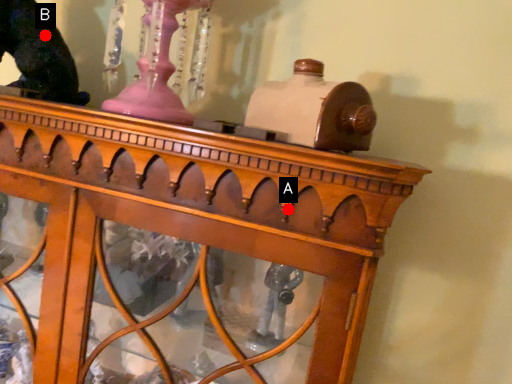
Question: Two points are circled on the image, labeled by A and B beside each circle. Which point is farther to the camera?

Choices:
 (A) A is further
 (B) B is further

Answer: (B)